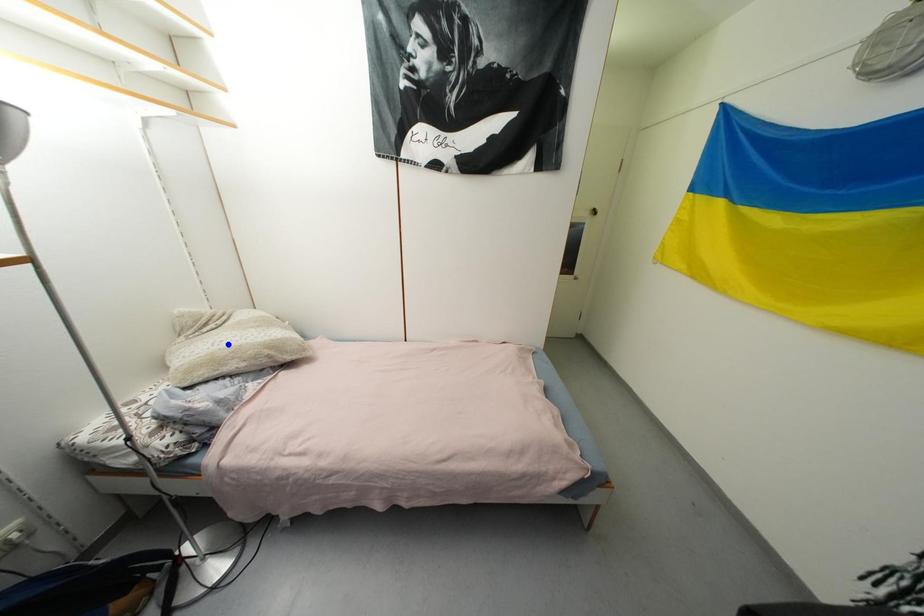
Question: Two points are marked on the image. Which point is closer to the camera?

Choices:
 (A) Blue point is closer.
 (B) Red point is closer.

Answer: (B)